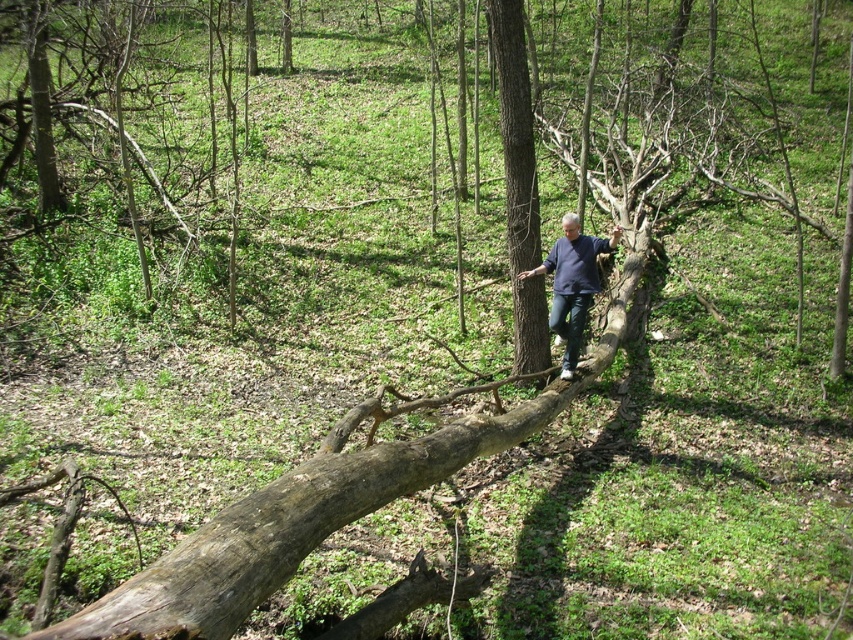
Question: Among these points, which one is farthest from the camera?

Choices:
 (A) (521, 147)
 (B) (590, 256)

Answer: (A)

Question: Does brown rough tree trunk at center come in front of dark blue shirt at center?

Choices:
 (A) no
 (B) yes

Answer: (A)

Question: Does brown rough tree trunk at center appear over dark blue shirt at center?

Choices:
 (A) no
 (B) yes

Answer: (B)

Question: Among these objects, which one is nearest to the camera?

Choices:
 (A) brown rough tree trunk at center
 (B) dark blue shirt at center

Answer: (B)

Question: Is brown rough tree trunk at center above dark blue shirt at center?

Choices:
 (A) no
 (B) yes

Answer: (B)